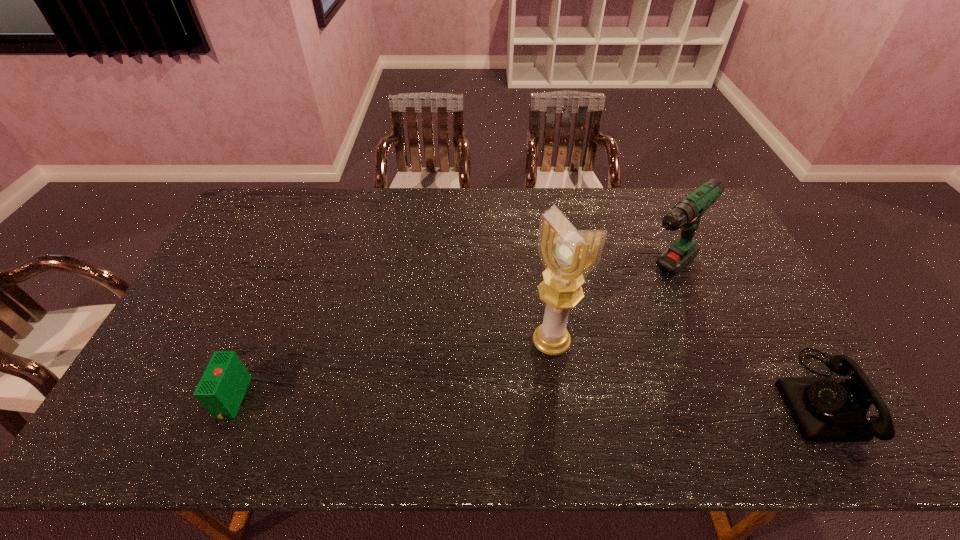
The width and height of the screenshot is (960, 540). Find the location of `vacant space on the desktop that is between the alarm clock and the rightmost object and is positioned on the handle side of the third object from left to right`. vacant space on the desktop that is between the alarm clock and the rightmost object and is positioned on the handle side of the third object from left to right is located at coordinates (521, 397).

Where is `free space on the desktop that is between the leftmost object and the rightmost object and is positioned on the front-facing side of the second object from left to right`? Image resolution: width=960 pixels, height=540 pixels. free space on the desktop that is between the leftmost object and the rightmost object and is positioned on the front-facing side of the second object from left to right is located at coordinates (499, 398).